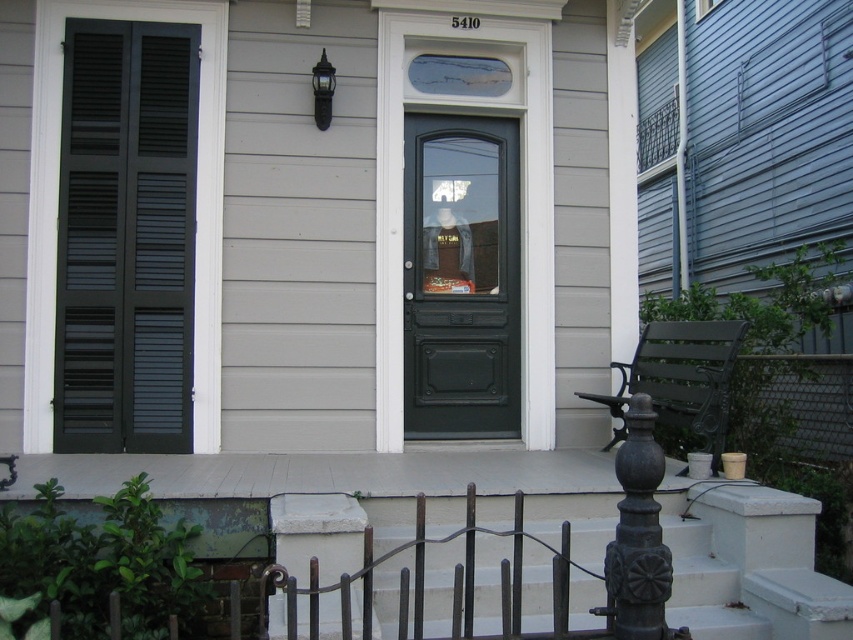
Question: Which object appears closest to the camera in this image?

Choices:
 (A) dark gray louvered shutters at left
 (B) matte black door at center

Answer: (A)

Question: Can you confirm if dark gray louvered shutters at left is smaller than matte black door at center?

Choices:
 (A) yes
 (B) no

Answer: (B)

Question: Does matte black door at center have a smaller size compared to blue painted wood window at upper center?

Choices:
 (A) no
 (B) yes

Answer: (A)

Question: Among these points, which one is nearest to the camera?

Choices:
 (A) (67, 340)
 (B) (708, 1)
 (C) (468, 384)

Answer: (A)

Question: Which object is the closest to the blue painted wood window at upper center?

Choices:
 (A) matte black door at center
 (B) dark gray louvered shutters at left

Answer: (A)

Question: From the image, what is the correct spatial relationship of matte black door at center in relation to blue painted wood window at upper center?

Choices:
 (A) right
 (B) left

Answer: (B)